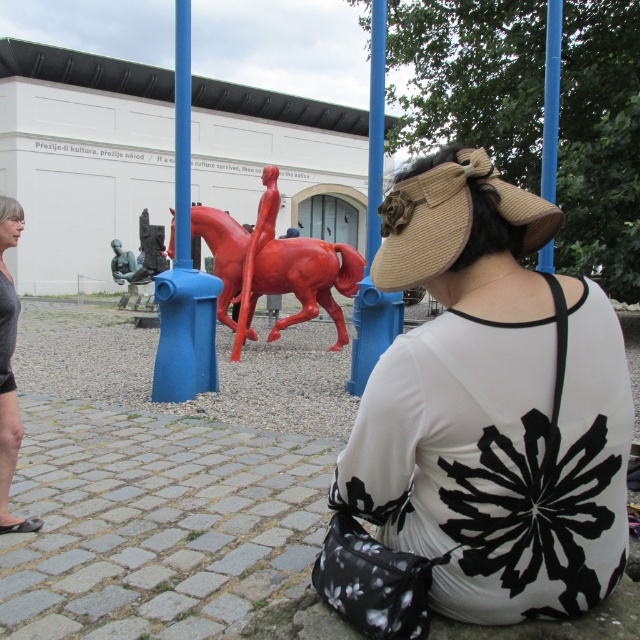
Question: Which point appears closest to the camera in this image?

Choices:
 (A) 570,285
 (B) 113,243

Answer: (A)

Question: Which point is farther to the camera?

Choices:
 (A) brushed metal statue at center
 (B) white floral-patterned dress at center
 (C) shiny red horse at center
 (D) gray fabric pants at lower left

Answer: (A)

Question: Can you confirm if white floral-patterned dress at center is positioned to the right of brushed metal statue at center?

Choices:
 (A) no
 (B) yes

Answer: (B)

Question: Does white floral-patterned dress at center appear on the right side of brushed metal statue at center?

Choices:
 (A) no
 (B) yes

Answer: (B)

Question: Among these points, which one is nearest to the camera?

Choices:
 (A) (316, 259)
 (B) (124, 275)

Answer: (A)

Question: Can you confirm if shiny red horse at center is positioned to the right of gray fabric pants at lower left?

Choices:
 (A) yes
 (B) no

Answer: (A)